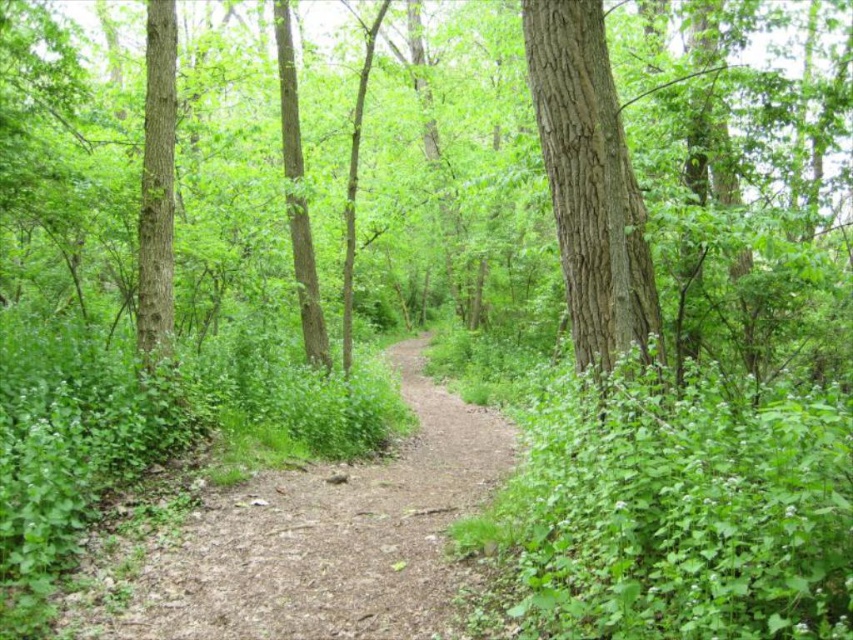
Question: Which is farther from the brown dirt path at center?

Choices:
 (A) brown rough tree at center
 (B) brown textured bark tree at center

Answer: (A)

Question: Can you confirm if brown dirt path at center is thinner than brown textured bark tree at center?

Choices:
 (A) yes
 (B) no

Answer: (B)

Question: Does brown rough tree at center appear on the left side of smooth brown tree trunk at left?

Choices:
 (A) no
 (B) yes

Answer: (A)

Question: Among these points, which one is farthest from the camera?

Choices:
 (A) (570, 20)
 (B) (270, 625)
 (C) (460, 257)
 (D) (171, 240)

Answer: (C)

Question: Does brown dirt path at center have a smaller size compared to brown textured bark tree at center?

Choices:
 (A) yes
 (B) no

Answer: (B)

Question: Which point appears farthest from the camera in this image?

Choices:
 (A) (459, 452)
 (B) (540, 83)

Answer: (A)